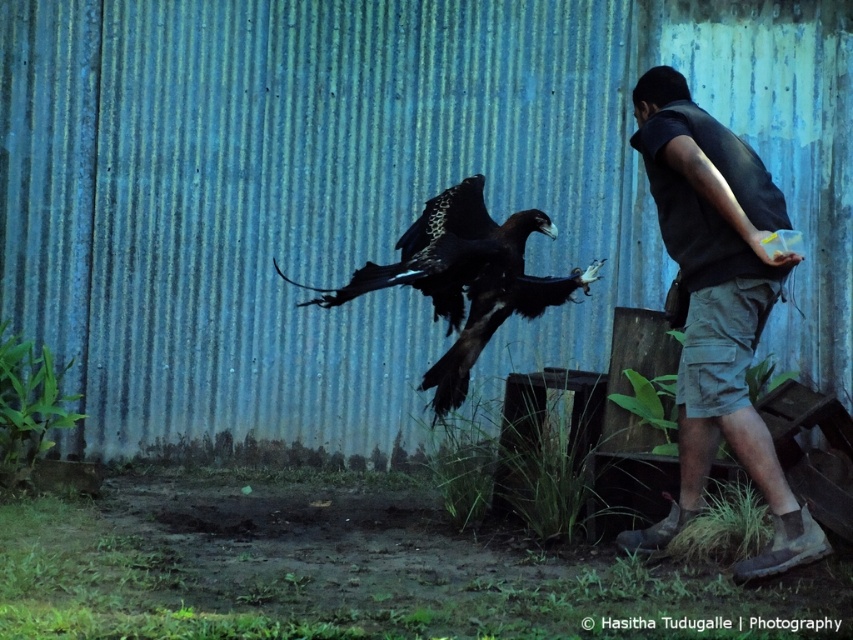
Question: Can you confirm if dark gray vest at right is wider than dark brown feathers at center?

Choices:
 (A) no
 (B) yes

Answer: (A)

Question: Is dark gray vest at right positioned in front of dark brown feathers at center?

Choices:
 (A) yes
 (B) no

Answer: (A)

Question: Is dark gray vest at right above dark brown feathers at center?

Choices:
 (A) no
 (B) yes

Answer: (A)